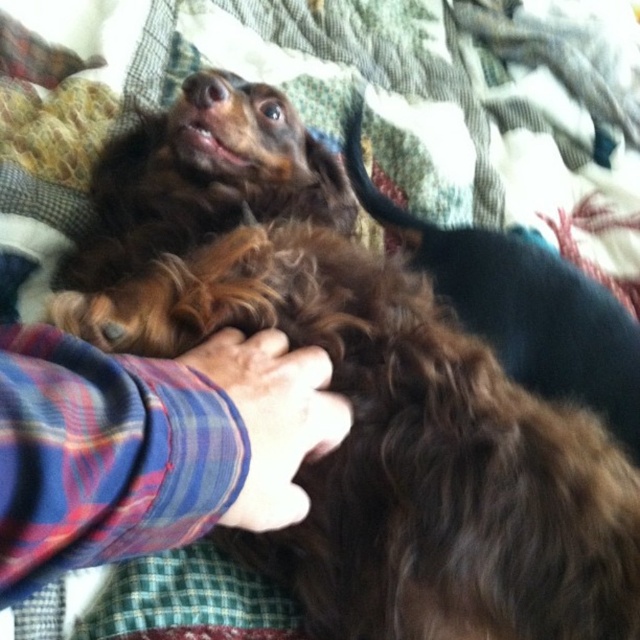
You are a dog owner who wants to ensure both dogs are comfortable. Which object is closer to you, the plaid fabric hand at center or the brown curly fur at center?

The plaid fabric hand at center is closer to you because it is in front of the brown curly fur at center.